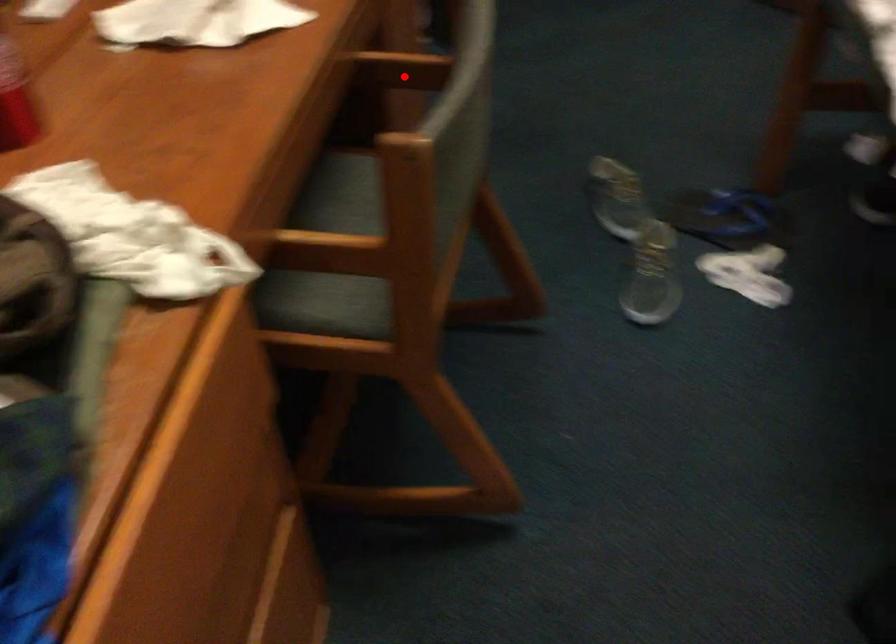
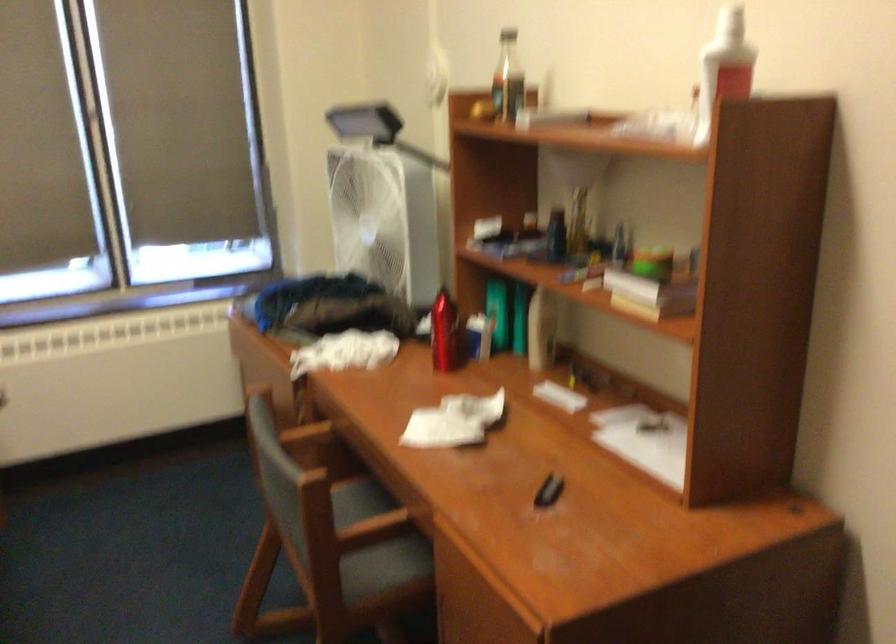
Question: I am providing you with two images of the same scene from different viewpoints. In image1, a red point is highlighted. Considering the same 3D point in image2, which of the following is correct?

Choices:
 (A) It is closer
 (B) It is farther

Answer: (B)